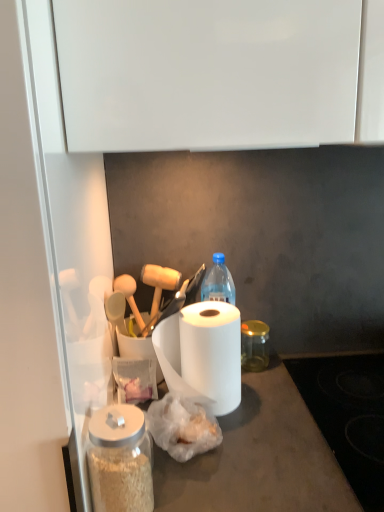
Question: Is translucent plastic bag at center bigger or smaller than white matte paper towel at center?

Choices:
 (A) big
 (B) small

Answer: (B)

Question: From a real-world perspective, is translucent plastic bag at center above or below white matte paper towel at center?

Choices:
 (A) below
 (B) above

Answer: (A)

Question: Which is farther from the white matte paper towel at center?

Choices:
 (A) transparent glass jar at lower left, the second glass jar in the right-to-left sequence
 (B) transparent glass jar at center, which is the second glass jar from left to right
 (C) translucent plastic bag at center

Answer: (A)

Question: Which object is the farthest from the transparent glass jar at lower left, the first glass jar viewed from the left?

Choices:
 (A) translucent plastic bag at center
 (B) transparent glass jar at center, which is the second glass jar from left to right
 (C) white matte paper towel at center

Answer: (B)